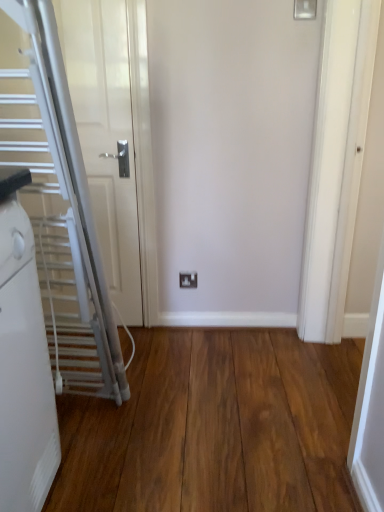
Question: Is wooden floor at center bigger or smaller than white plastic electric outlet at center?

Choices:
 (A) small
 (B) big

Answer: (B)

Question: Would you say wooden floor at center is inside or outside white plastic electric outlet at center?

Choices:
 (A) outside
 (B) inside

Answer: (A)

Question: Which of these objects is positioned closest to the white plastic electric outlet at center?

Choices:
 (A) wooden floor at center
 (B) silver metallic escalator at left

Answer: (A)

Question: Which is farther from the white plastic electric outlet at center?

Choices:
 (A) silver metallic escalator at left
 (B) wooden floor at center

Answer: (A)